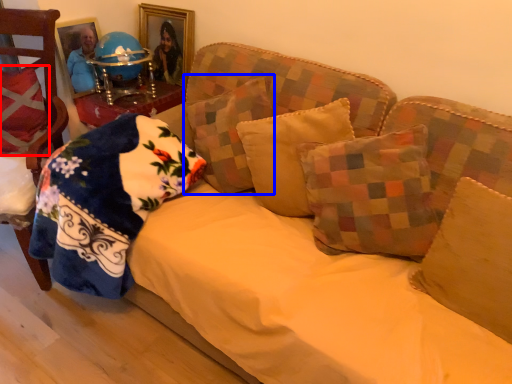
Question: Which of the following is the closest to the observer, pillow (highlighted by a red box) or pillow (highlighted by a blue box)?

Choices:
 (A) pillow
 (B) pillow

Answer: (B)